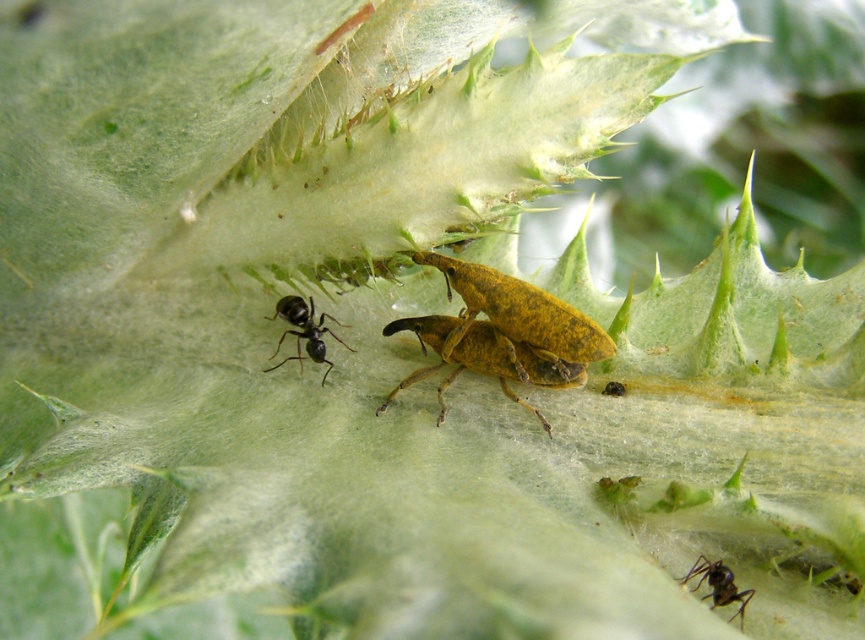
Can you confirm if yellowish-brown textured beetle at center is positioned below black matte ant at center?

Correct, yellowish-brown textured beetle at center is located below black matte ant at center.

Locate an element on the screen. The height and width of the screenshot is (640, 865). yellowish-brown textured beetle at center is located at coordinates (503, 332).

Can you confirm if black matte ant at center is bigger than black glossy ant at lower right?

Yes, black matte ant at center is bigger than black glossy ant at lower right.

Which of these two, black matte ant at center or black glossy ant at lower right, stands shorter?

black glossy ant at lower right is shorter.

Does point (300, 333) come closer to viewer compared to point (705, 595)?

No, it is not.

The width and height of the screenshot is (865, 640). I want to click on black matte ant at center, so click(304, 330).

Is point (549, 317) positioned after point (723, 593)?

Yes, it is behind point (723, 593).

Does point (434, 349) come in front of point (721, 596)?

No, it is not.

Locate an element on the screen. This screenshot has height=640, width=865. yellowish-brown textured beetle at center is located at coordinates (503, 332).